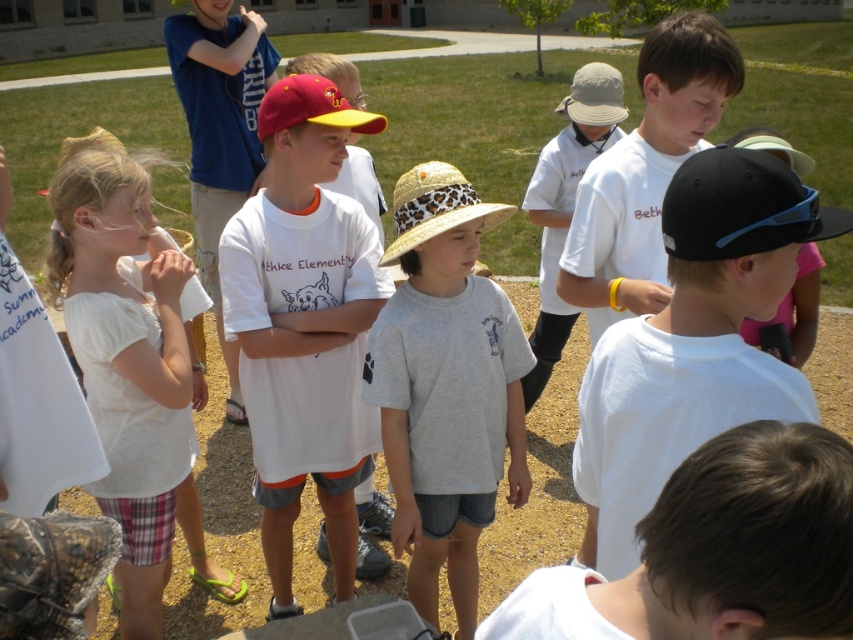
You are a photographer trying to capture a photo of the black matte cap at center and the white cotton shirt at center. Based on their positions, which one should you focus on first if you want to ensure both are in the frame without moving the camera?

The black matte cap at center is located below the white cotton shirt at center, so you should focus on the white cotton shirt at center first to ensure both are in the frame without moving the camera.

What are the coordinates of the gray cotton shirt at center?

The gray cotton shirt at center is located at coordinates point (445,387).